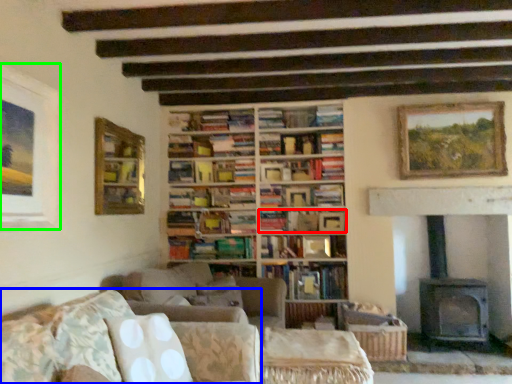
Question: Which object is positioned closest to book (highlighted by a red box)? Select from studio couch (highlighted by a blue box) and picture frame (highlighted by a green box).

Choices:
 (A) studio couch
 (B) picture frame

Answer: (A)